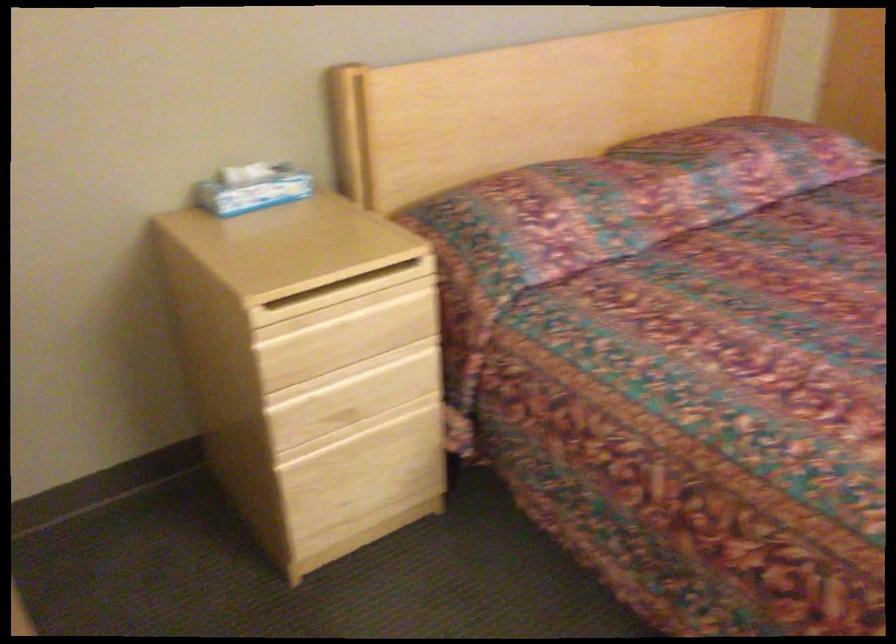
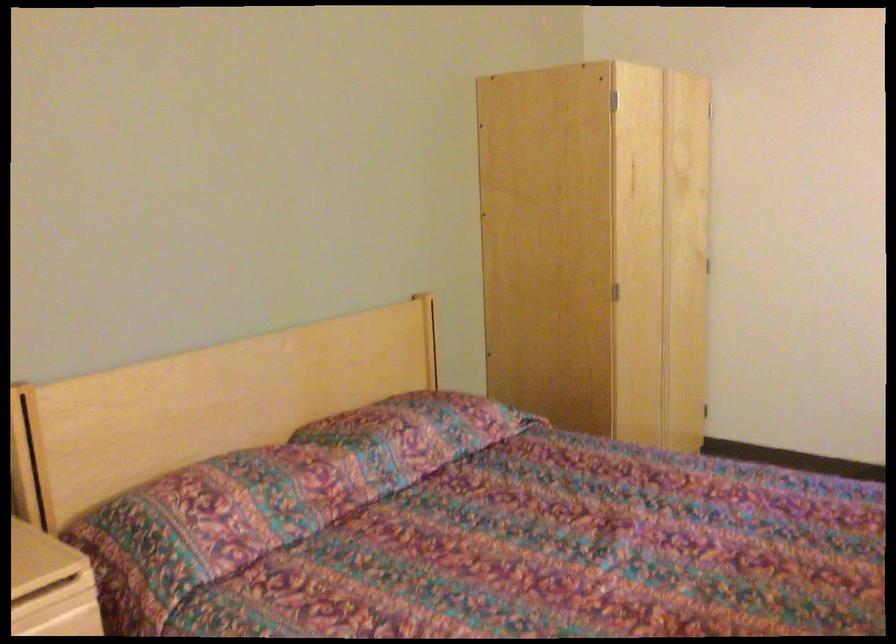
Find the pixel in the second image that matches pixel 540 222 in the first image.

(211, 518)